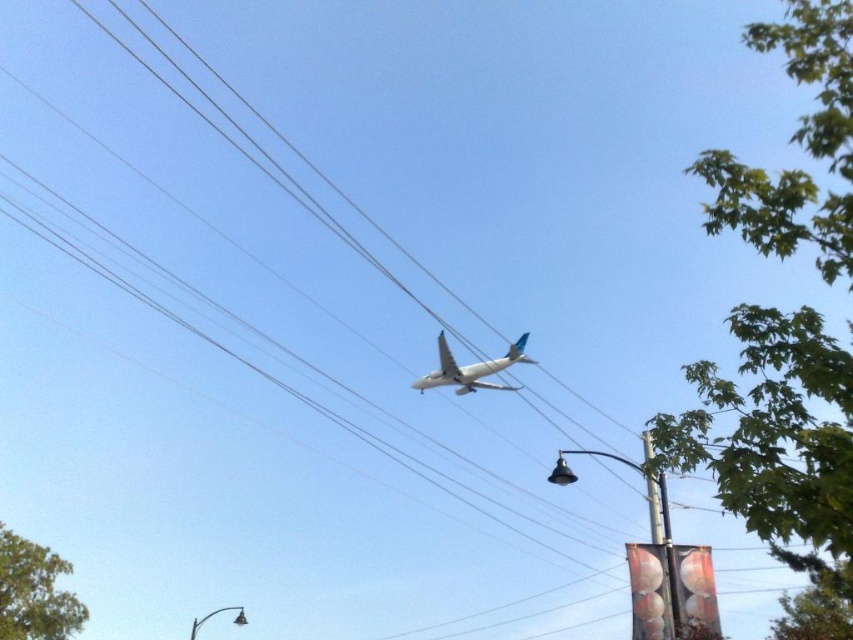
Between green leafy tree at upper right and green leafy tree at lower left, which one appears on the right side from the viewer's perspective?

From the viewer's perspective, green leafy tree at upper right appears more on the right side.

Does green leafy tree at upper right have a larger size compared to green leafy tree at lower left?

Indeed, green leafy tree at upper right has a larger size compared to green leafy tree at lower left.

The height and width of the screenshot is (640, 853). I want to click on green leafy tree at upper right, so click(776, 440).

Is white matte airplane at center to the left of metallic pole at right from the viewer's perspective?

Yes, white matte airplane at center is to the left of metallic pole at right.

Can you confirm if white matte airplane at center is smaller than metallic pole at right?

No.

What do you see at coordinates (469, 369) in the screenshot?
I see `white matte airplane at center` at bounding box center [469, 369].

I want to click on white matte airplane at center, so click(469, 369).

Does green leafy tree at upper right appear over metallic pole at right?

Yes, green leafy tree at upper right is above metallic pole at right.

Which is more to the left, green leafy tree at upper right or metallic pole at right?

metallic pole at right

Which is in front, point (817, 534) or point (680, 621)?

Point (817, 534)

You are a GUI agent. You are given a task and a screenshot of the screen. Output one action in this format:
    pyautogui.click(x=<x>, y=<y>)
    Task: Click on the green leafy tree at upper right
    The image size is (853, 640).
    Given the screenshot: What is the action you would take?
    pyautogui.click(x=776, y=440)